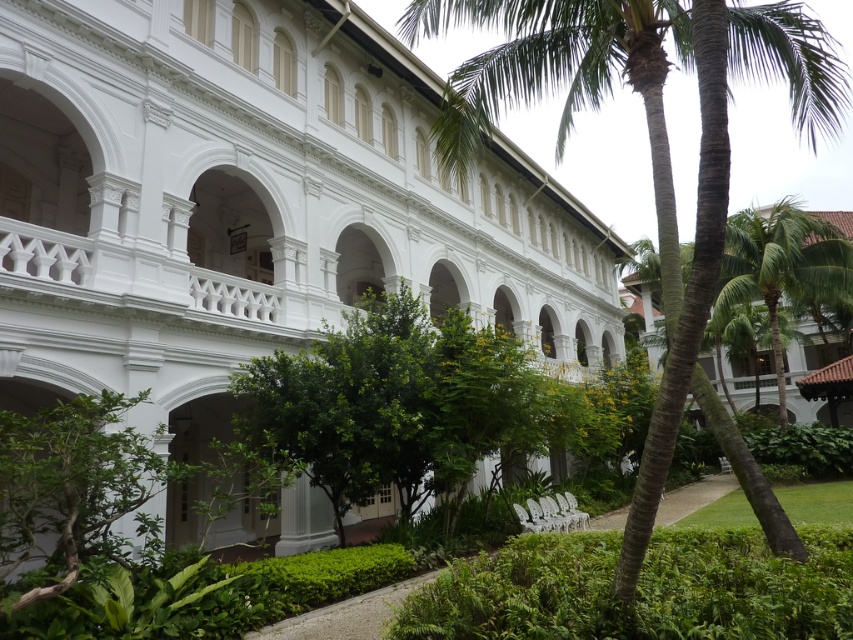
You are a landscape architect designing a garden layout. You need to place a new statue that requires a base 1.2 meters wide. The statue must be placed between the white smooth building at center and the green textured palm tree at center. Is there enough space between them for the statue?

The white smooth building at center is smaller than the green textured palm tree at center, but the exact distance between them isn

You are standing in front of the white smooth building at center and the green textured palm tree at center. Which object is closer to you?

The white smooth building at center is closer to you because it is further to the viewer than the green textured palm tree at center.

You are standing in front of the white smooth building at center and the green textured palm tree at center. Which object is positioned higher in the image?

The green textured palm tree at center is positioned higher than the white smooth building at center because the white smooth building at center is located below it.